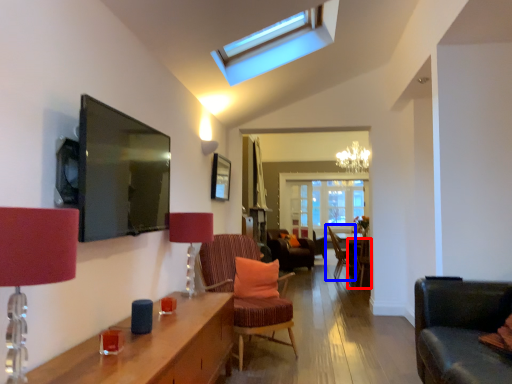
Question: Which point is further to the camera, chair (highlighted by a red box) or chair (highlighted by a blue box)?

Choices:
 (A) chair
 (B) chair

Answer: (B)